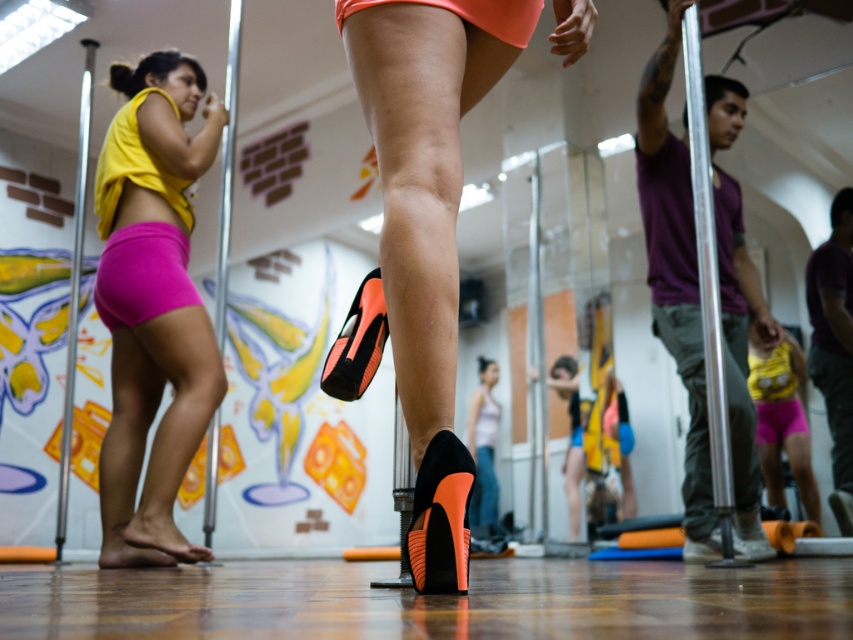
Can you confirm if pink fabric shorts at lower left is wider than orange matte high-heeled shoe at center?

Correct, the width of pink fabric shorts at lower left exceeds that of orange matte high-heeled shoe at center.

Is point (103, 316) positioned after point (383, 298)?

Yes, point (103, 316) is behind point (383, 298).

What are the coordinates of `pink fabric shorts at lower left` in the screenshot? It's located at (142, 275).

Does pink fabric shorts at lower left have a smaller size compared to purple fabric underwear at lower center?

Incorrect, pink fabric shorts at lower left is not smaller in size than purple fabric underwear at lower center.

Locate an element on the screen. pink fabric shorts at lower left is located at coordinates (142, 275).

This screenshot has width=853, height=640. Identify the location of pink fabric shorts at lower left. (142, 275).

This screenshot has width=853, height=640. Find the location of `pink fabric shorts at lower left`. pink fabric shorts at lower left is located at coordinates (142, 275).

Is black suede high-heeled shoe at lower center shorter than purple fabric underwear at lower center?

Correct, black suede high-heeled shoe at lower center is not as tall as purple fabric underwear at lower center.

Does point (440, 588) lie behind point (781, 428)?

No.

Is point (412, 509) farther from camera compared to point (798, 433)?

No.

The height and width of the screenshot is (640, 853). Find the location of `black suede high-heeled shoe at lower center`. black suede high-heeled shoe at lower center is located at coordinates point(440,516).